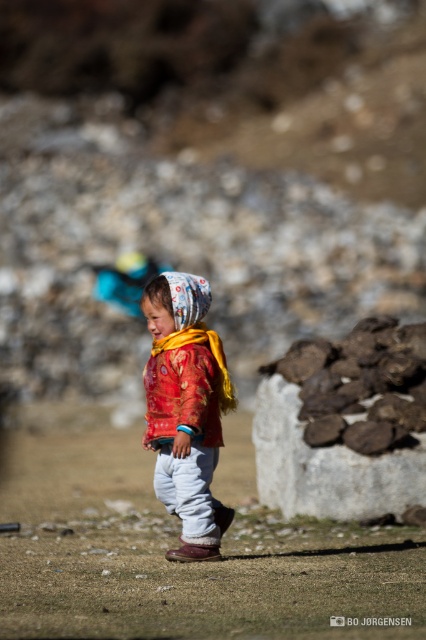
Question: Does matte red jacket at center lie in front of red fabric shawl at center?

Choices:
 (A) no
 (B) yes

Answer: (B)

Question: Is dark brown rock at center below matte red jacket at center?

Choices:
 (A) no
 (B) yes

Answer: (B)

Question: Where is dark brown rock at center located in relation to red fabric shawl at center in the image?

Choices:
 (A) left
 (B) right

Answer: (B)

Question: Estimate the real-world distances between objects in this image. Which object is closer to the dark brown rock at center?

Choices:
 (A) matte red jacket at center
 (B) printed fabric headscarf at center

Answer: (A)

Question: Estimate the real-world distances between objects in this image. Which object is farther from the red fabric shawl at center?

Choices:
 (A) printed fabric headscarf at center
 (B) matte red jacket at center
 (C) dark brown rock at center

Answer: (C)

Question: Which point is closer to the camera?

Choices:
 (A) red fabric shawl at center
 (B) matte red jacket at center
 (C) printed fabric headscarf at center

Answer: (B)